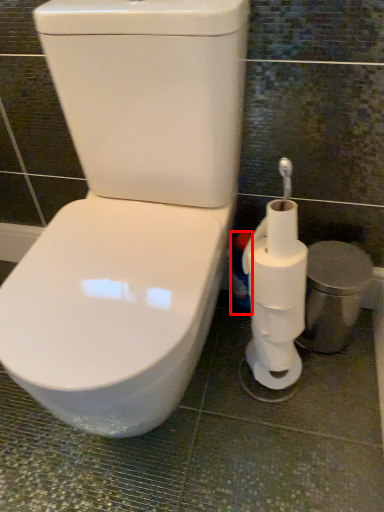
Question: From the image's perspective, considering the relative positions of cleaning product (annotated by the red box) and toilet paper in the image provided, where is cleaning product (annotated by the red box) located with respect to the staircase?

Choices:
 (A) below
 (B) above

Answer: (A)